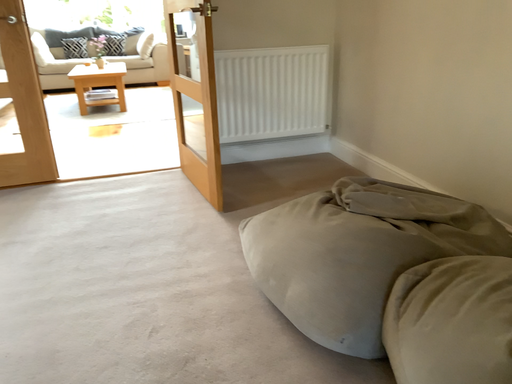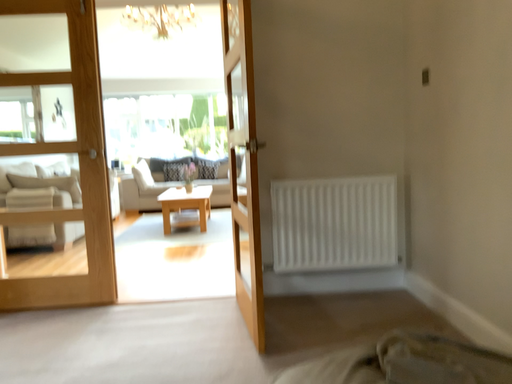
Question: Which way did the camera rotate in the video?

Choices:
 (A) rotated downward
 (B) rotated upward

Answer: (B)